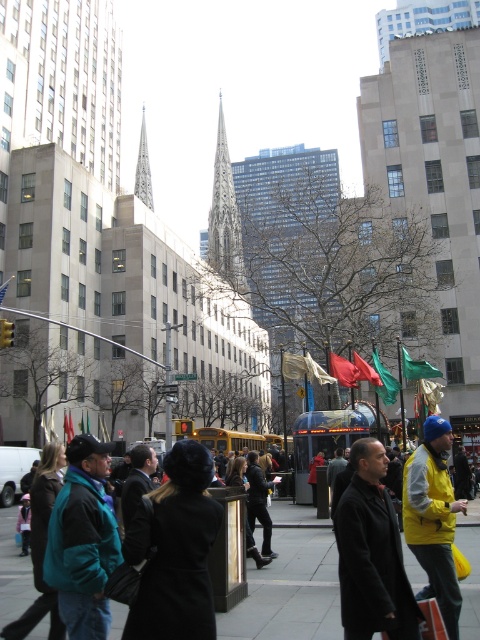
You are standing at the camera position looking at the city street scene. There are two points marked in the image, one at coordinates point (202,515) and another at point (228,273). Which of these two points is physically closer to you?

Point (202,515) is closer to the camera than point (228,273), so the point at coordinates point (202,515) is physically closer to you.

You are a fashion designer observing the bustling urban scene. You notice the black wool coat at center and the teal fleece jacket at lower left. Which clothing item is placed higher in the image?

The black wool coat at center is positioned over the teal fleece jacket at lower left, meaning it is higher in the image.

You are a photographer standing on the sidewalk in this urban scene. You want to take a photo of the carved stone spire at center without any people blocking it. Is the black wool coat at center currently in front of or behind the spire?

The black wool coat at center is positioned under carved stone spire at center, so it is directly below the spire and not blocking it from view. You can take the photo without any obstruction from the coat.